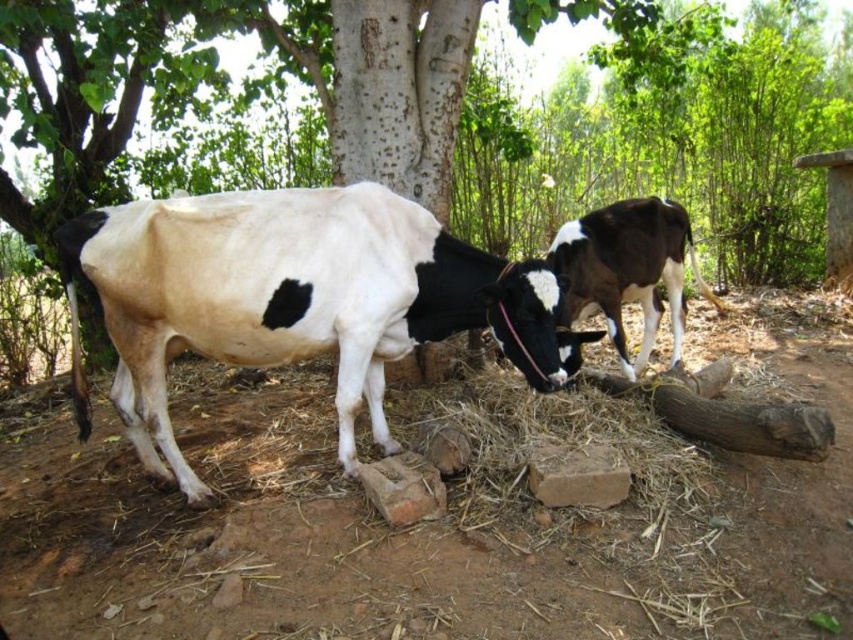
Is brown soil at center above black and white cow at right?

Incorrect, brown soil at center is not positioned above black and white cow at right.

Does brown soil at center have a greater width compared to black and white cow at right?

Indeed, brown soil at center has a greater width compared to black and white cow at right.

This screenshot has width=853, height=640. I want to click on brown soil at center, so click(x=445, y=515).

I want to click on brown soil at center, so click(x=445, y=515).

In the scene shown: Who is positioned more to the left, black and white cow at center or black and white cow at right?

black and white cow at center is more to the left.

Who is taller, black and white cow at center or black and white cow at right?

With more height is black and white cow at center.

Which is in front, point (308, 273) or point (567, 323)?

Point (308, 273)

The width and height of the screenshot is (853, 640). Find the location of `black and white cow at center`. black and white cow at center is located at coordinates (291, 300).

Can you confirm if brown soil at center is positioned to the right of black and white cow at center?

In fact, brown soil at center is to the left of black and white cow at center.

Can you confirm if brown soil at center is smaller than black and white cow at center?

No.

This screenshot has width=853, height=640. Describe the element at coordinates (445, 515) in the screenshot. I see `brown soil at center` at that location.

This screenshot has width=853, height=640. Find the location of `brown soil at center`. brown soil at center is located at coordinates (445, 515).